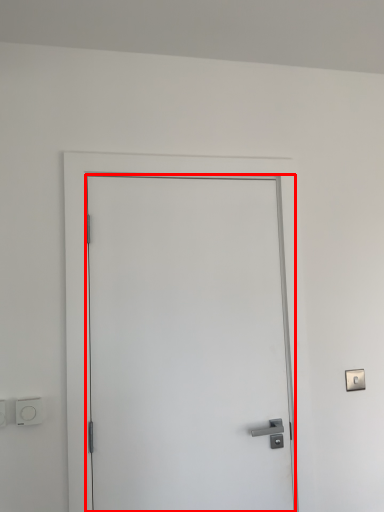
Question: From the image's perspective, what is the correct spatial positioning of door (annotated by the red box) in reference to light switch?

Choices:
 (A) below
 (B) above

Answer: (B)